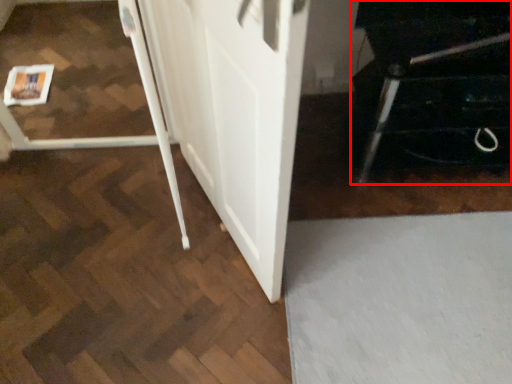
Question: In this image, where is furniture (annotated by the red box) located relative to barn door?

Choices:
 (A) right
 (B) left

Answer: (A)